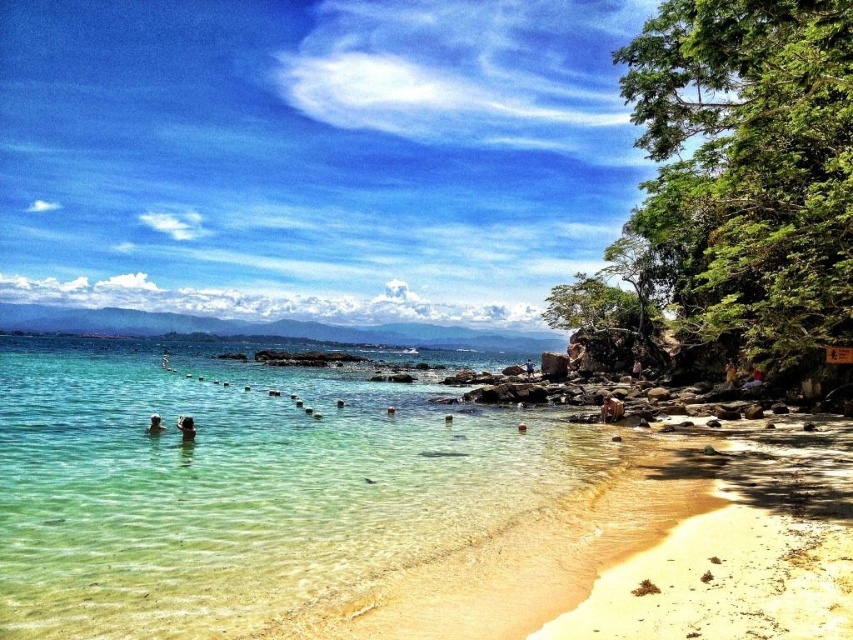
Is point (605, 401) closer to camera compared to point (734, 368)?

Yes, point (605, 401) is in front of point (734, 368).

Between point (619, 400) and point (724, 371), which one is positioned behind?

The point (724, 371) is behind.

Image resolution: width=853 pixels, height=640 pixels. What are the coordinates of `brown textured person at lower right` in the screenshot? It's located at (611, 408).

Based on the photo, which is more to the right, skinny person at lower left or brown furry dog at lower right?

From the viewer's perspective, brown furry dog at lower right appears more on the right side.

Does skinny person at lower left have a greater width compared to brown furry dog at lower right?

In fact, skinny person at lower left might be narrower than brown furry dog at lower right.

You are a GUI agent. You are given a task and a screenshot of the screen. Output one action in this format:
    pyautogui.click(x=<x>, y=<y>)
    Task: Click on the skinny person at lower left
    The image size is (853, 640).
    Given the screenshot: What is the action you would take?
    pyautogui.click(x=186, y=428)

Looking at this image, is brown textured person at lower right to the right of light brown skin at lower left from the viewer's perspective?

Indeed, brown textured person at lower right is positioned on the right side of light brown skin at lower left.

At what (x,y) coordinates should I click in order to perform the action: click on brown textured person at lower right. Please return your answer as a coordinate pair (x, y). Looking at the image, I should click on tap(611, 408).

Between point (614, 410) and point (155, 429), which one is positioned in front?

Positioned in front is point (155, 429).

Find the location of a particular element. This screenshot has height=640, width=853. brown textured person at lower right is located at coordinates (611, 408).